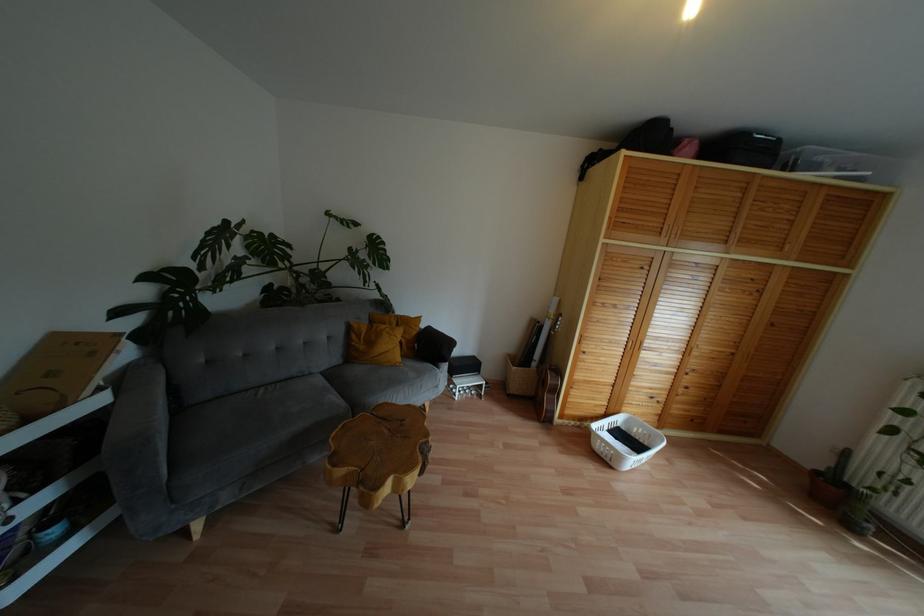
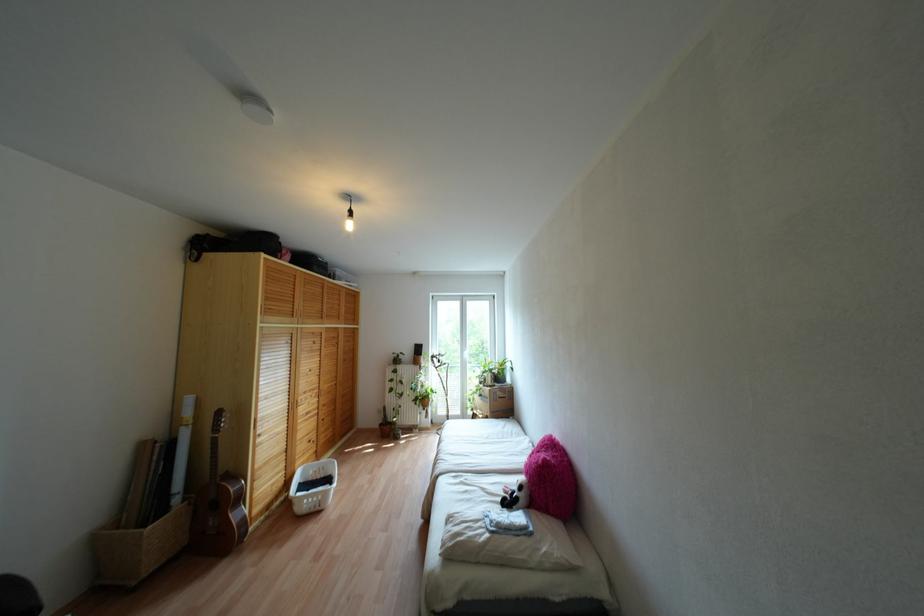
Find the pixel in the second image that matches [606,460] in the first image.

(317, 508)